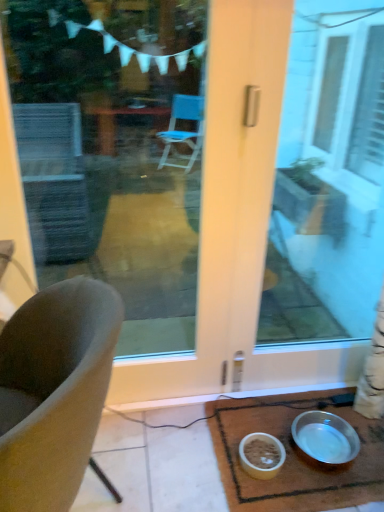
Locate an element on the screen. The image size is (384, 512). free point behind silver metallic bowl at lower right, the 2th bowl in the left-to-right sequence is located at coordinates (308, 406).